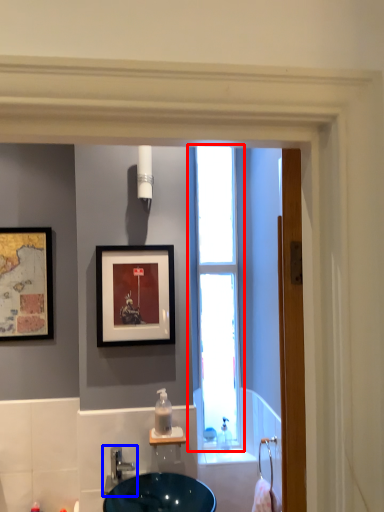
Question: Which point is further to the camera, window (highlighted by a red box) or tap (highlighted by a blue box)?

Choices:
 (A) window
 (B) tap

Answer: (A)